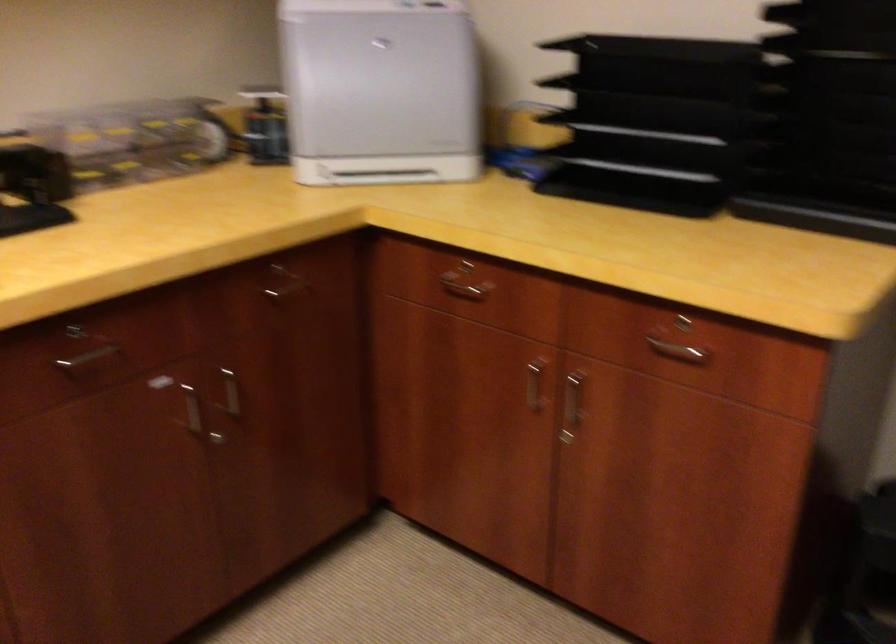
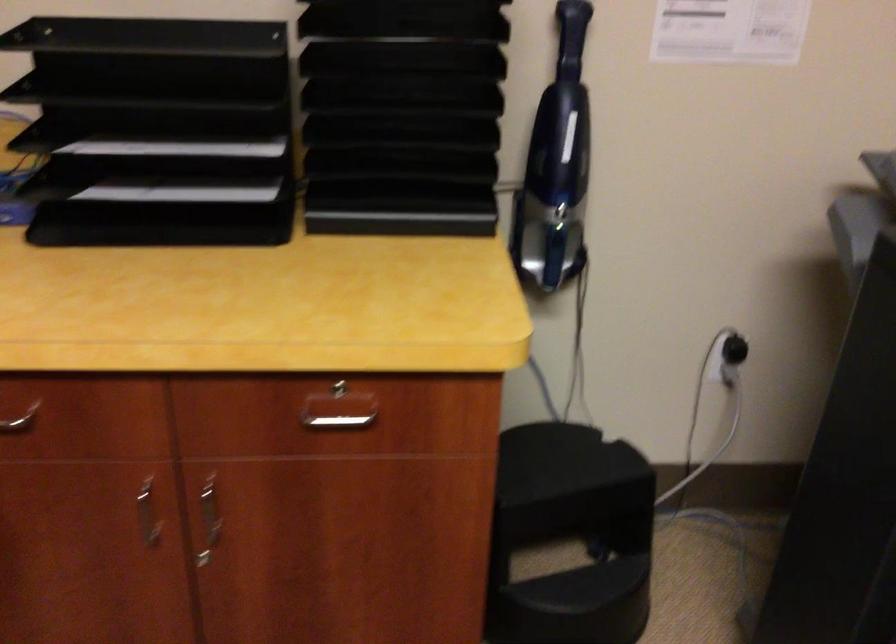
Locate, in the second image, the point that corresponds to pixel 575 410 in the first image.

(209, 520)